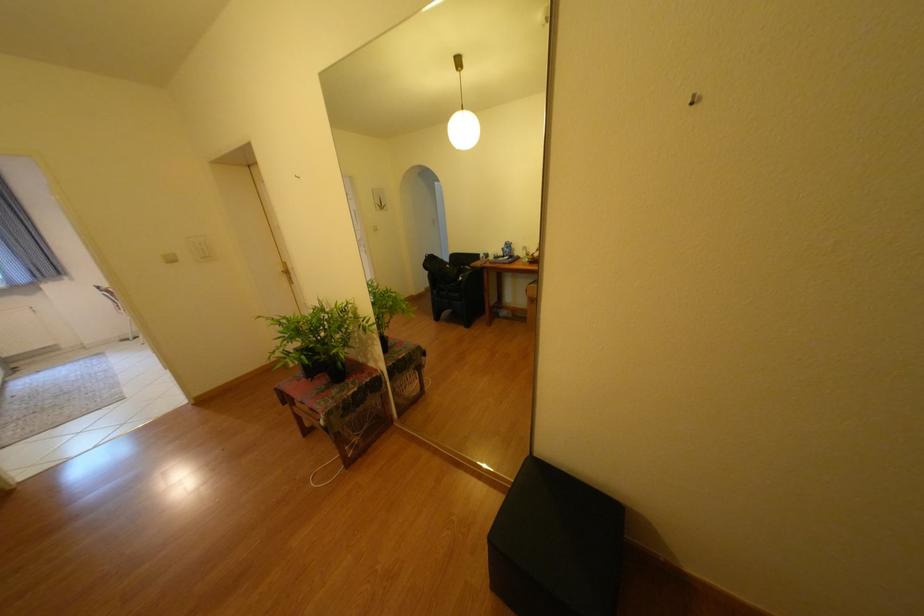
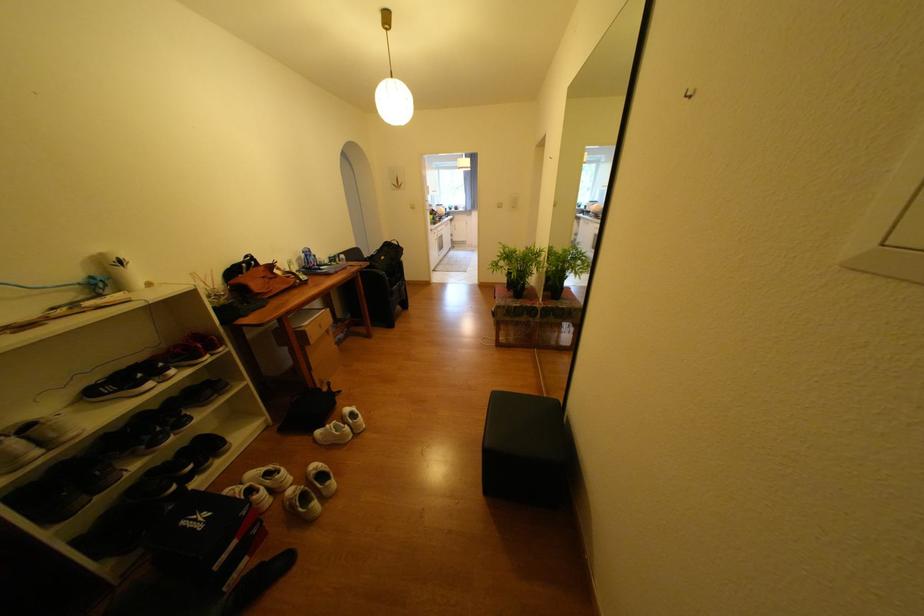
Where in the second image is the point corresponding to point 332,381 from the first image?

(520, 294)